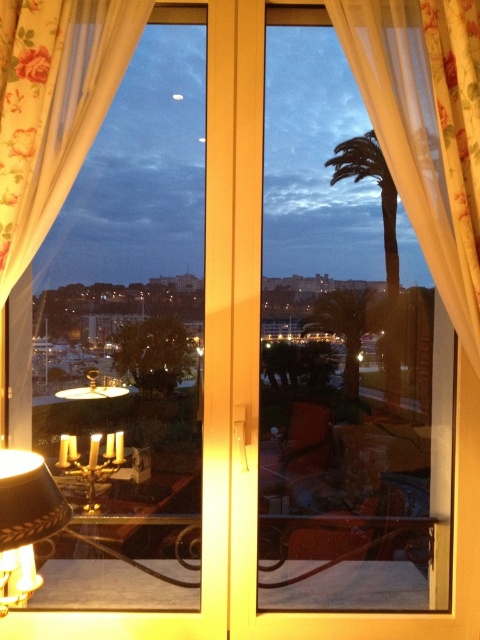
Question: Does floral fabric curtain at right appear over matte black lampshade at lower left?

Choices:
 (A) no
 (B) yes

Answer: (B)

Question: Based on their relative distances, which object is farther from the floral fabric curtain at upper left?

Choices:
 (A) floral fabric curtain at right
 (B) green leafy palm tree at center

Answer: (B)

Question: Can you confirm if floral fabric curtain at upper left is positioned below green leafy palm tree at center?

Choices:
 (A) no
 (B) yes

Answer: (A)

Question: Can you confirm if floral fabric curtain at upper left is positioned to the left of matte black lampshade at lower left?

Choices:
 (A) yes
 (B) no

Answer: (A)

Question: Which of these objects is positioned closest to the green leafy palm tree at center?

Choices:
 (A) floral fabric curtain at upper left
 (B) matte black lampshade at lower left
 (C) floral fabric curtain at right

Answer: (C)

Question: Estimate the real-world distances between objects in this image. Which object is closer to the floral fabric curtain at upper left?

Choices:
 (A) floral fabric curtain at right
 (B) matte black lampshade at lower left
 (C) green leafy palm tree at center

Answer: (A)